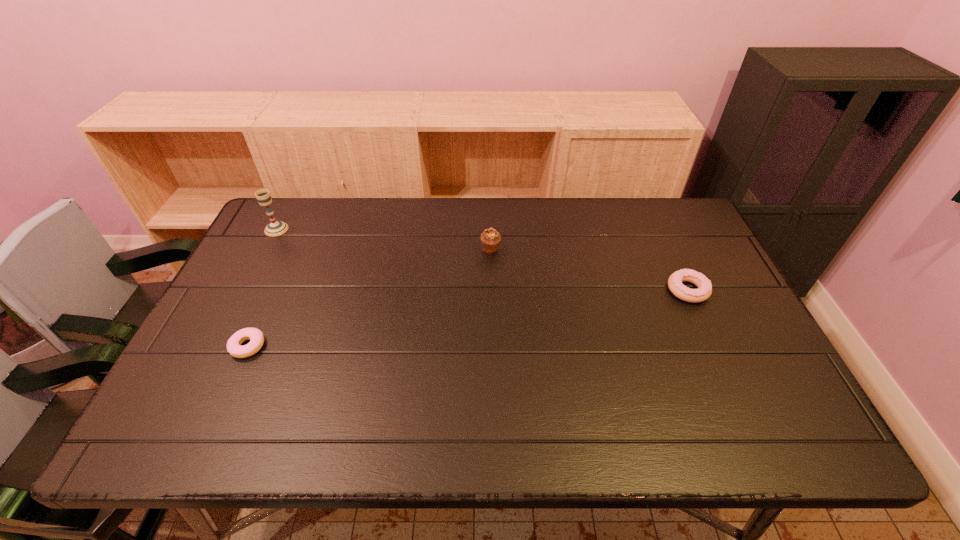
The height and width of the screenshot is (540, 960). I want to click on vacant space that's between the farthest object and the third shortest object, so click(x=383, y=239).

The height and width of the screenshot is (540, 960). Identify the location of empty location between the second farthest object and the farthest object. (383, 239).

Where is `vacant area that lies between the second farthest object and the tallest object`? This screenshot has width=960, height=540. vacant area that lies between the second farthest object and the tallest object is located at coordinates (383, 239).

Where is `free point between the second tallest object and the farthest object`? This screenshot has height=540, width=960. free point between the second tallest object and the farthest object is located at coordinates (383, 239).

At what (x,y) coordinates should I click in order to perform the action: click on object that can be found as the closest to the shorter doughnut. Please return your answer as a coordinate pair (x, y). Looking at the image, I should click on (275, 228).

You are a GUI agent. You are given a task and a screenshot of the screen. Output one action in this format:
    pyautogui.click(x=<x>, y=<y>)
    Task: Click on the object that is the second closest to the taller doughnut
    The width and height of the screenshot is (960, 540).
    Given the screenshot: What is the action you would take?
    pyautogui.click(x=256, y=337)

At what (x,y) coordinates should I click in order to perform the action: click on free spot that satisfies the following two spatial constraints: 1. on the front side of the tallest object; 2. on the left side of the left doughnut. Please return your answer as a coordinate pair (x, y). The width and height of the screenshot is (960, 540). Looking at the image, I should click on (216, 346).

Locate an element on the screen. The image size is (960, 540). free spot that satisfies the following two spatial constraints: 1. on the back side of the second tallest object; 2. on the right side of the nearest object is located at coordinates click(x=292, y=249).

At what (x,y) coordinates should I click in order to perform the action: click on free space that satisfies the following two spatial constraints: 1. on the back side of the second tallest object; 2. on the right side of the shorter doughnut. Please return your answer as a coordinate pair (x, y). This screenshot has width=960, height=540. Looking at the image, I should click on (292, 249).